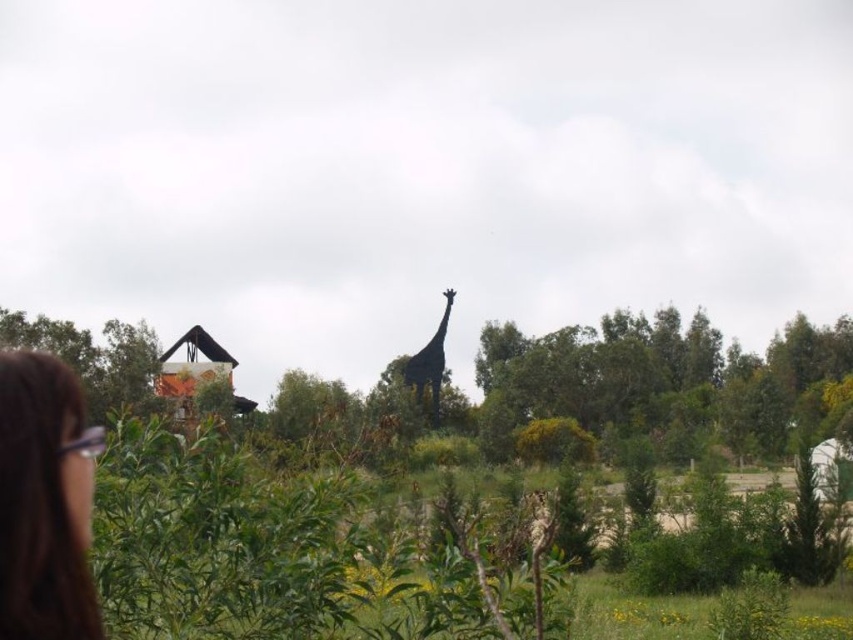
Can you confirm if brown hair at lower left is smaller than shiny black giraffe at center?

Yes.

Can you confirm if brown hair at lower left is bigger than shiny black giraffe at center?

No.

Is point (16, 387) positioned behind point (415, 380)?

That is False.

Where is `brown hair at lower left`? The height and width of the screenshot is (640, 853). brown hair at lower left is located at coordinates (44, 500).